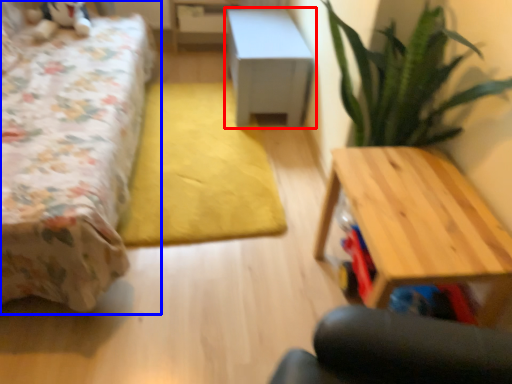
Question: Which point is further to the camera, table (highlighted by a red box) or bed (highlighted by a blue box)?

Choices:
 (A) table
 (B) bed

Answer: (A)